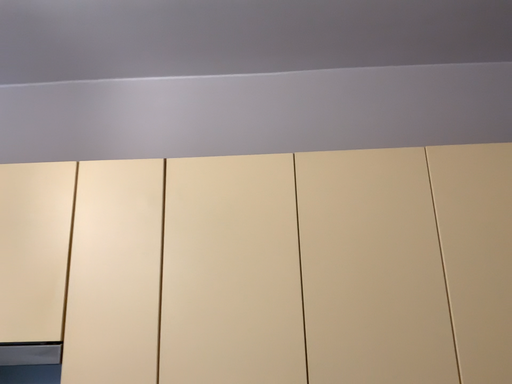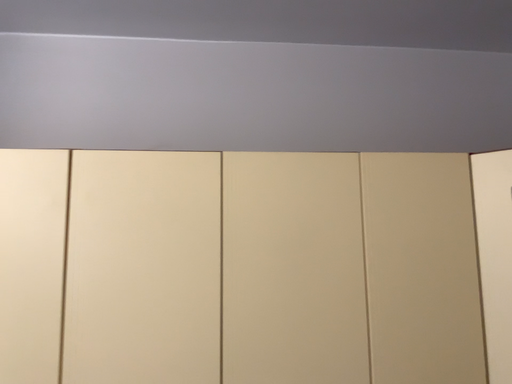
Question: Which way did the camera rotate in the video?

Choices:
 (A) rotated upward
 (B) rotated downward

Answer: (B)